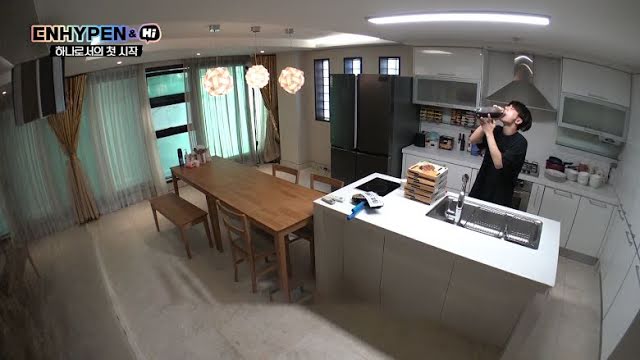
Where is `bottle`? The image size is (640, 360). bottle is located at coordinates (490, 112).